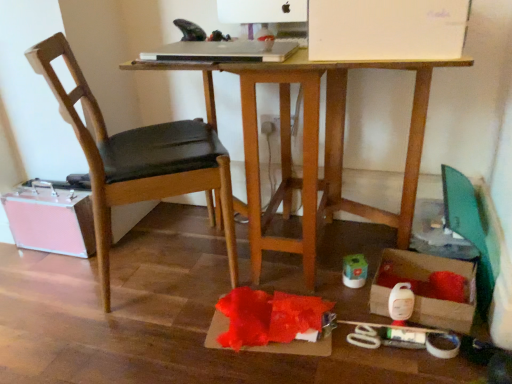
Where is `free point below black leather chair at left (from a real-world perspective)`? This screenshot has height=384, width=512. free point below black leather chair at left (from a real-world perspective) is located at coordinates point(146,266).